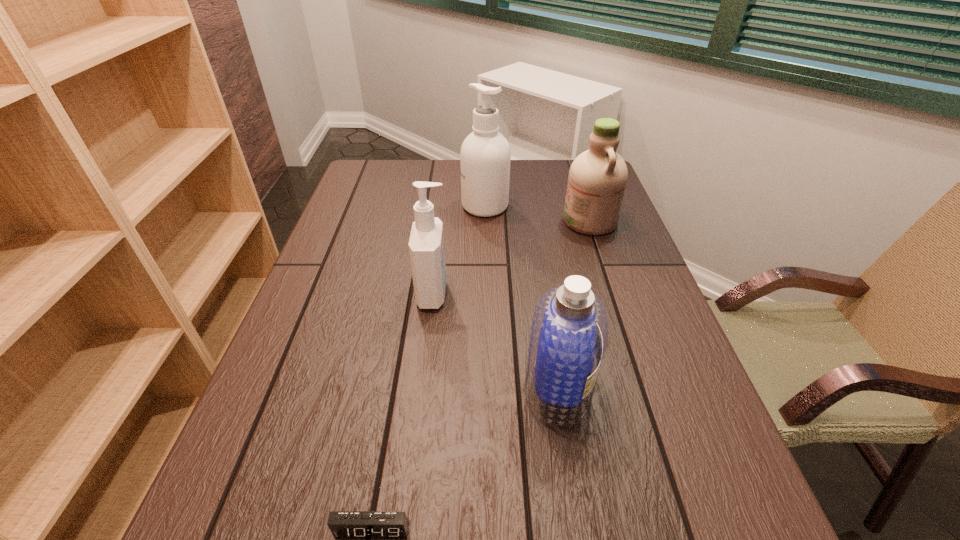
The height and width of the screenshot is (540, 960). In order to click on vacant space that satisfies the following two spatial constraints: 1. on the back side of the second nearest object; 2. on the front label of the third farthest cleansing agent in this screenshot , I will do `click(543, 293)`.